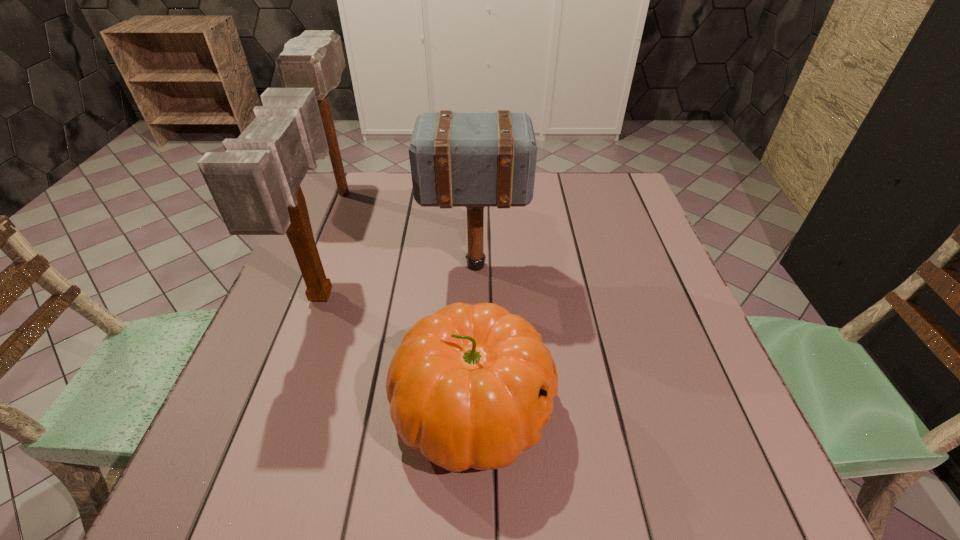
Locate an element on the screen. mallet that is the closest to the farthest object is located at coordinates (255, 183).

Find the location of a particular element. the second closest mallet to the pumpkin is located at coordinates (458, 159).